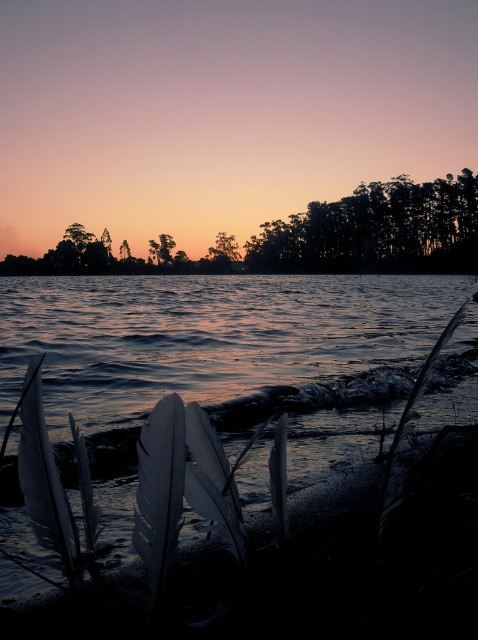
Question: Among these points, which one is nearest to the camera?

Choices:
 (A) (426, 216)
 (B) (151, 244)

Answer: (A)

Question: Which point is closer to the camera taking this photo?

Choices:
 (A) (393, 189)
 (B) (147, 492)
 (C) (236, 244)

Answer: (B)

Question: Is silhouette trees at upper center smaller than dark green leafy trees at upper center?

Choices:
 (A) yes
 (B) no

Answer: (B)

Question: Does silhouette trees at upper center appear over dark green leafy trees at upper center?

Choices:
 (A) yes
 (B) no

Answer: (A)

Question: Is dark green leafy trees at upper center positioned in front of green leafy tree at center?

Choices:
 (A) yes
 (B) no

Answer: (A)

Question: Among these objects, which one is farthest from the camera?

Choices:
 (A) dark green leafy trees at upper center
 (B) silhouette trees at upper center

Answer: (A)